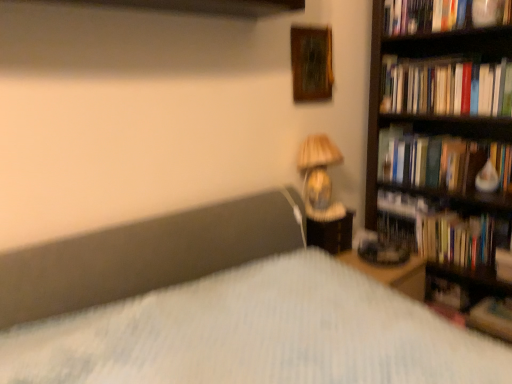
Question: Does point (298, 61) appear closer or farther from the camera than point (506, 61)?

Choices:
 (A) farther
 (B) closer

Answer: (B)

Question: From their relative heights in the image, would you say wooden picture frame at upper center is taller or shorter than hardcover books at right, the second book viewed from the top?

Choices:
 (A) tall
 (B) short

Answer: (A)

Question: Considering the real-world distances, which object is farthest from the wooden picture frame at upper center?

Choices:
 (A) hardcover book at right
 (B) hardcover book at right, positioned as the 1th book in bottom-to-top order
 (C) hardcover book at upper right, which is the fourth book from bottom to top
 (D) hardcover book at right, the third book from the top
 (E) matte beige lampshade at upper right

Answer: (B)

Question: Which object is positioned closest to the matte plastic nightstand at right?

Choices:
 (A) hardcover book at right, the third book from the top
 (B) hardcover book at upper right, which is the fourth book from bottom to top
 (C) wooden picture frame at upper center
 (D) matte beige lampshade at upper right
 (E) hardcover book at right, positioned as the 1th book in bottom-to-top order

Answer: (D)